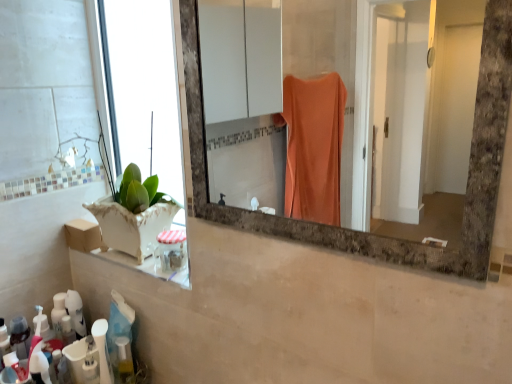
Question: From the image's perspective, is white glossy lotion at lower left, which appears as the third toiletry when viewed from the right, positioned above or below marble frame mirror at center?

Choices:
 (A) below
 (B) above

Answer: (A)

Question: Is white glossy lotion at lower left, placed as the 3th toiletry when sorted from top to bottom, to the left or to the right of marble frame mirror at center in the image?

Choices:
 (A) left
 (B) right

Answer: (A)

Question: Which is farther from the marble frame mirror at center?

Choices:
 (A) green leafy plant at left
 (B) white plastic bottle at lower left, placed as the 2th toiletry when sorted from top to bottom
 (C) white glossy lotion at lower left, arranged as the 2th toiletry when ordered from the bottom
 (D) clear plastic jar at lower left, which is the 4th toiletry from bottom to top
 (E) translucent plastic toothbrush at lower left, which is the first toiletry in bottom-to-top order

Answer: (E)

Question: Considering the real-world distances, which object is farthest from the translucent plastic toothbrush at lower left, which is the first toiletry in bottom-to-top order?

Choices:
 (A) green leafy plant at left
 (B) clear plastic jar at lower left, arranged as the 1th toiletry when viewed from the top
 (C) white plastic bottle at lower left, acting as the second toiletry starting from the right
 (D) marble frame mirror at center
 (E) white glossy lotion at lower left, which is the 2th toiletry from left to right

Answer: (D)